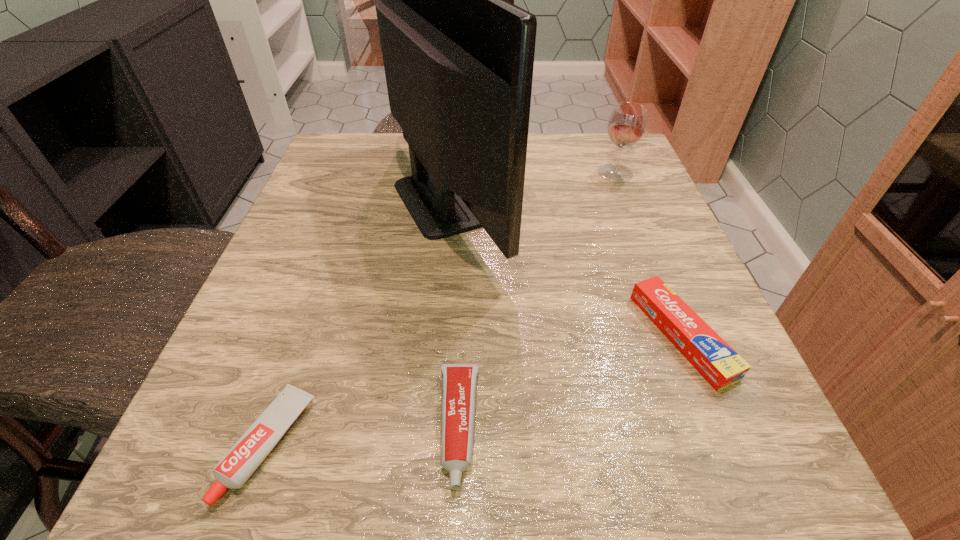
At what (x,y) coordinates should I click in order to perform the action: click on free point between the computer monitor and the second toothpaste from right to left. Please return your answer as a coordinate pair (x, y). This screenshot has height=540, width=960. Looking at the image, I should click on tap(453, 313).

This screenshot has height=540, width=960. I want to click on the closest object relative to the tallest object, so coord(458,393).

Select which object appears as the third closest to the second toothpaste from left to right. Please provide its 2D coordinates. Your answer should be formatted as a tuple, i.e. [(x, y)], where the tuple contains the x and y coordinates of a point satisfying the conditions above.

[(720, 365)]

The image size is (960, 540). I want to click on the closest toothpaste relative to the second toothpaste from left to right, so click(x=235, y=468).

Find the location of `toothpaste identified as the second closest to the second toothpaste from left to right`. toothpaste identified as the second closest to the second toothpaste from left to right is located at coordinates (720, 365).

Where is `vacant space that satisfies the following two spatial constraints: 1. on the back side of the rightmost toothpaste; 2. on the front-facing side of the tallest object`? The image size is (960, 540). vacant space that satisfies the following two spatial constraints: 1. on the back side of the rightmost toothpaste; 2. on the front-facing side of the tallest object is located at coordinates (627, 200).